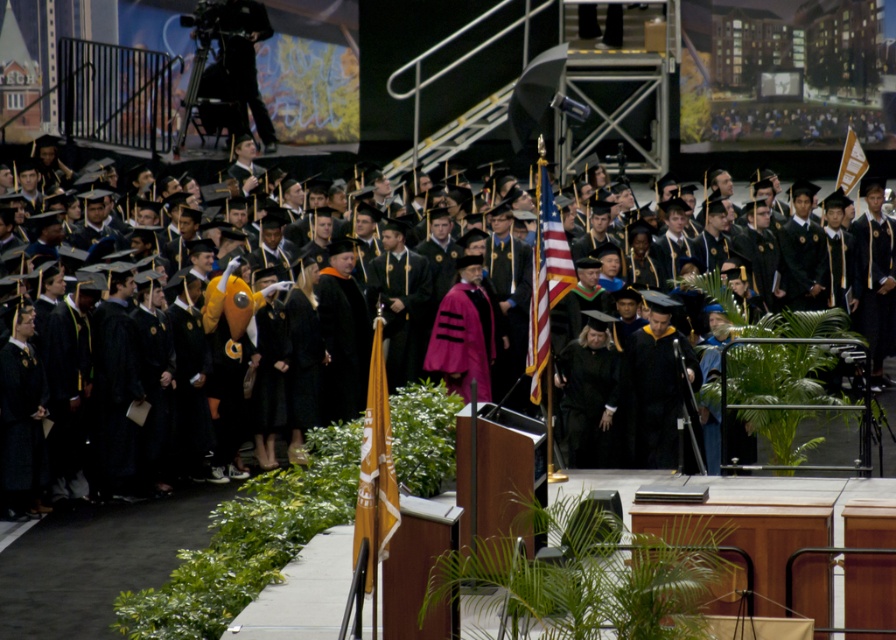
Can you confirm if orange fabric flag at center is bigger than american flag at center?

Yes, orange fabric flag at center is bigger than american flag at center.

Who is more forward, (372, 490) or (561, 253)?

Positioned in front is point (372, 490).

You are a GUI agent. You are given a task and a screenshot of the screen. Output one action in this format:
    pyautogui.click(x=<x>, y=<y>)
    Task: Click on the orange fabric flag at center
    This screenshot has width=896, height=640.
    Given the screenshot: What is the action you would take?
    pyautogui.click(x=375, y=468)

This screenshot has height=640, width=896. What are the coordinates of `orange fabric flag at center` in the screenshot? It's located at (375, 468).

Does orange fabric flag at center have a larger size compared to orange fabric flag at upper right?

Correct, orange fabric flag at center is larger in size than orange fabric flag at upper right.

Who is positioned more to the left, orange fabric flag at center or orange fabric flag at upper right?

orange fabric flag at center is more to the left.

At what (x,y) coordinates should I click in order to perform the action: click on orange fabric flag at center. Please return your answer as a coordinate pair (x, y). Looking at the image, I should click on (375, 468).

Is point (28, 522) less distant than point (378, 458)?

No.

Between matte black graduation gown at center and orange fabric flag at center, which one is positioned higher?

orange fabric flag at center is higher up.

What do you see at coordinates (139, 512) in the screenshot? I see `matte black graduation gown at center` at bounding box center [139, 512].

Find the location of `matte black graduation gown at center`. matte black graduation gown at center is located at coordinates (139, 512).